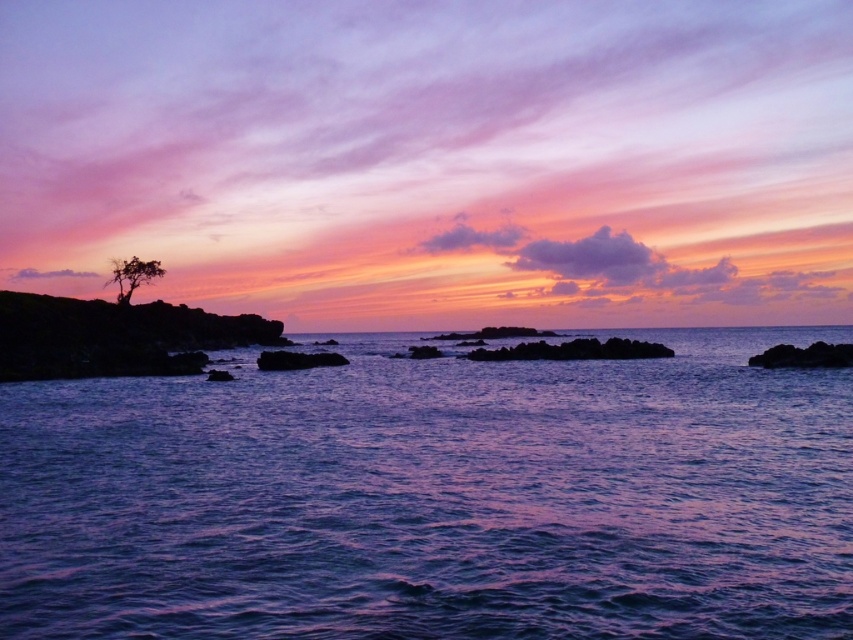
Does point (105, 525) lie in front of point (152, 276)?

Yes, it is.

Is purple translucent water at center taller than silhouette tree at left?

In fact, purple translucent water at center may be shorter than silhouette tree at left.

Is point (83, 596) positioned in front of point (141, 284)?

Yes.

Find the location of `purple translucent water at center`. purple translucent water at center is located at coordinates (436, 497).